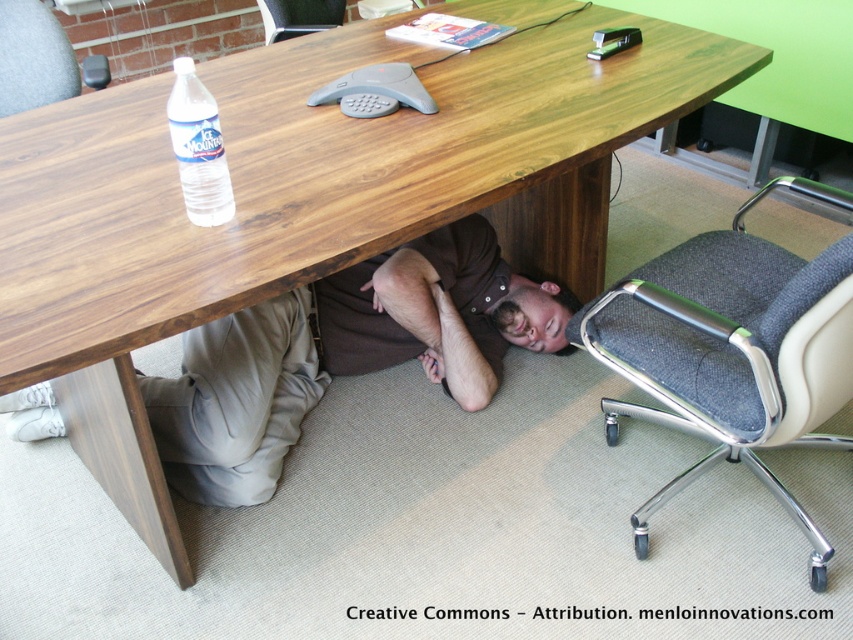
Question: Which of these objects is positioned closest to the gray fabric swivel chair at lower right?

Choices:
 (A) metallic gray chair at upper center
 (B) brown cotton shirt at under table

Answer: (B)

Question: Is clear plastic bottle at lower left below metallic gray chair at upper center?

Choices:
 (A) no
 (B) yes

Answer: (B)

Question: Does brown cotton shirt at under table appear on the right side of smooth brown hair at under desk?

Choices:
 (A) no
 (B) yes

Answer: (A)

Question: Can you confirm if gray fabric swivel chair at lower right is bigger than smooth brown hair at under desk?

Choices:
 (A) yes
 (B) no

Answer: (A)

Question: Estimate the real-world distances between objects in this image. Which object is farther from the clear plastic bottle at lower left?

Choices:
 (A) brown cotton shirt at under table
 (B) metallic gray chair at upper center
 (C) gray fabric chair at lower left

Answer: (B)

Question: Which object is closer to the camera taking this photo?

Choices:
 (A) gray fabric swivel chair at lower right
 (B) clear plastic bottle at lower left
 (C) gray fabric chair at lower left

Answer: (A)